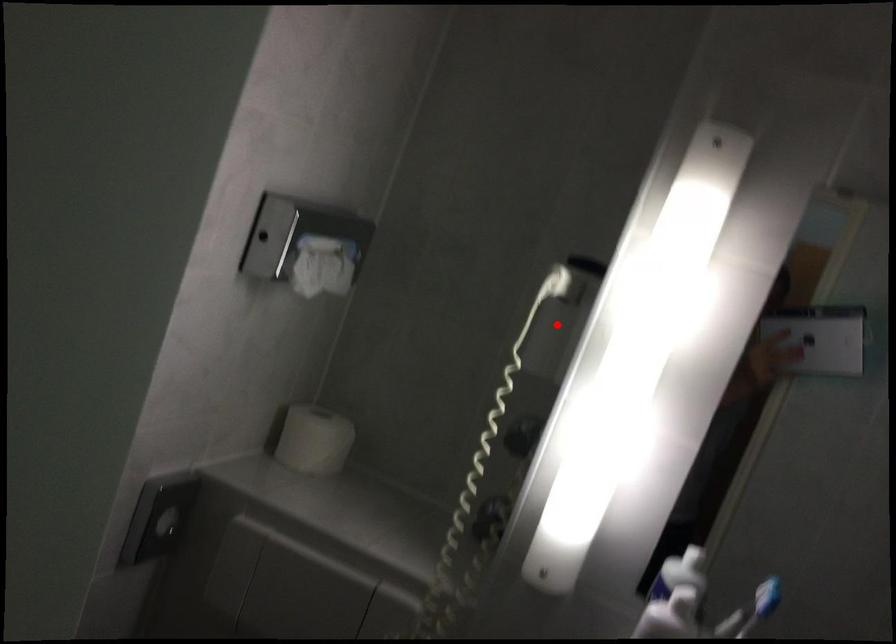
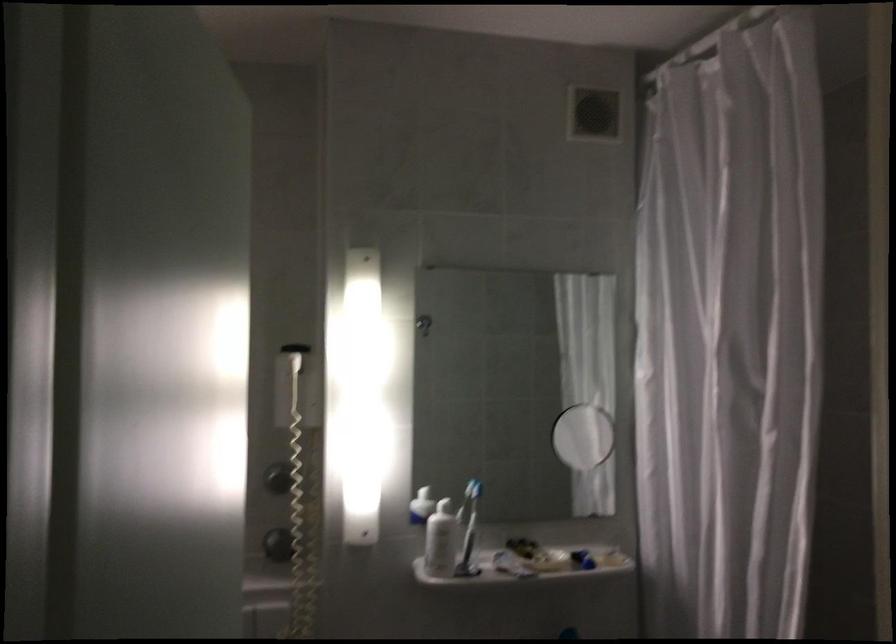
Question: I am providing you with two images of the same scene from different viewpoints. Image1 has a red point marked. In image2, the corresponding 3D location appears at what relative position? Reply with the corresponding letter.

Choices:
 (A) Closer
 (B) Farther

Answer: (B)